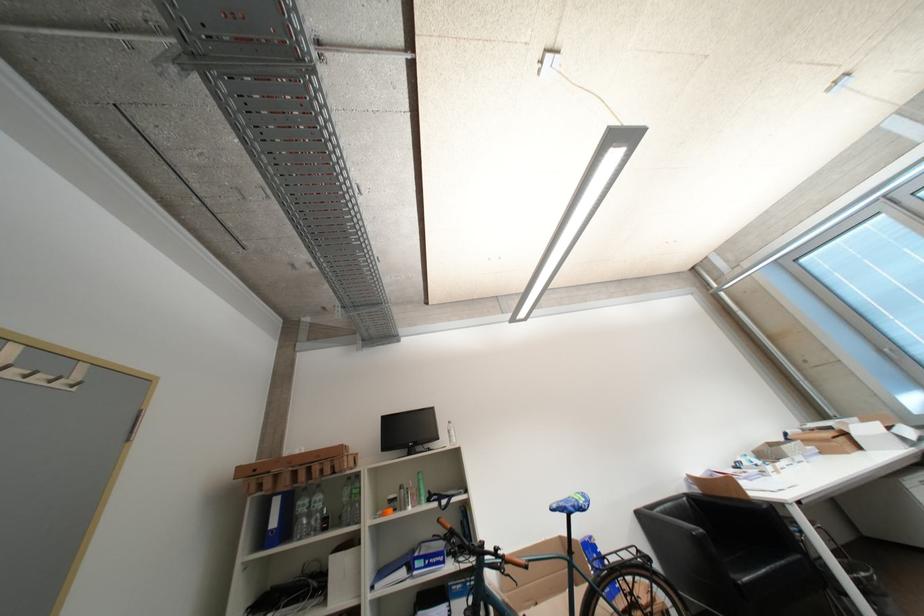
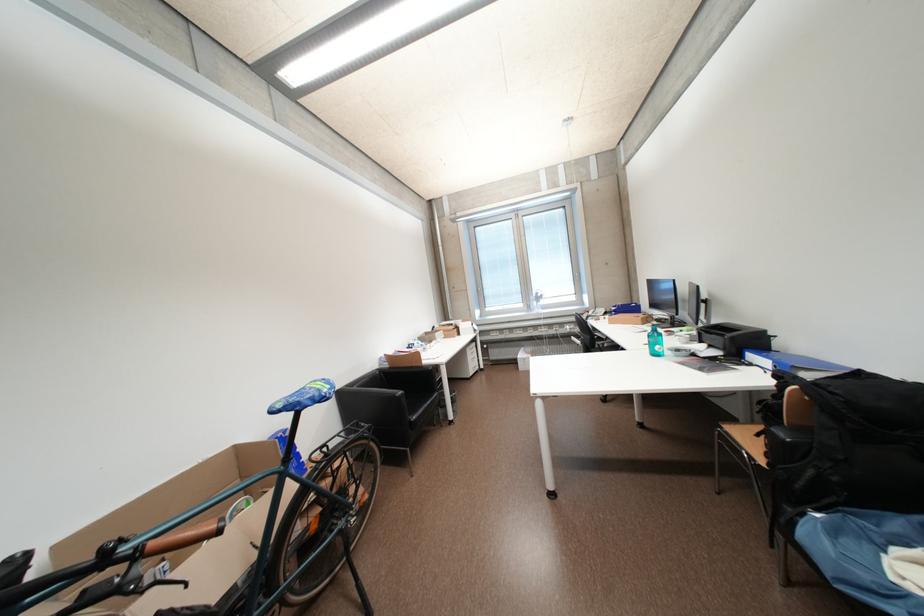
Find the pixel in the second image that matches (x=794, y=436) in the first image.

(442, 330)